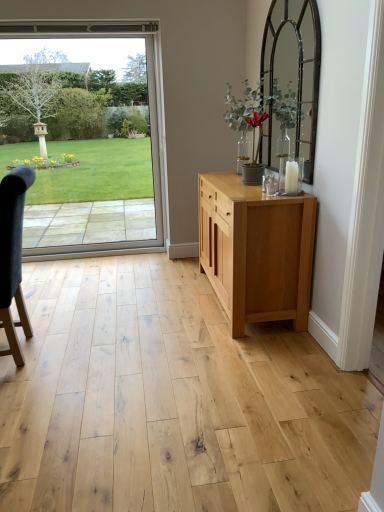
Where is `vacant area that is in front of clear glass door at left`? This screenshot has height=512, width=384. vacant area that is in front of clear glass door at left is located at coordinates [91, 286].